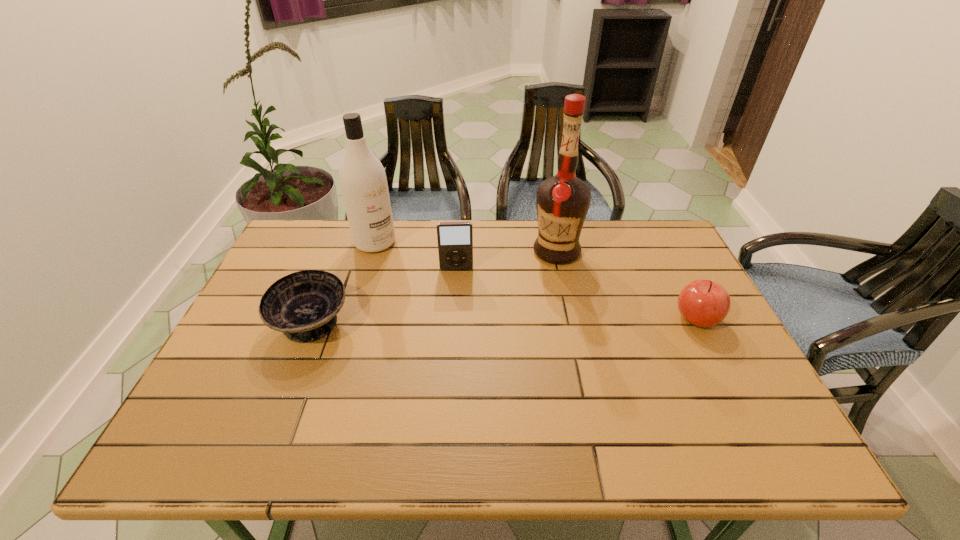
This screenshot has height=540, width=960. I want to click on free spot between the second tallest object and the fourth tallest object, so click(x=536, y=280).

Identify the location of empty location between the second shortest object and the iPod. This screenshot has height=540, width=960. (577, 294).

At what (x,y) coordinates should I click in order to perform the action: click on free point between the shortest object and the iPod. Please return your answer as a coordinate pair (x, y). Looking at the image, I should click on (384, 296).

You are a GUI agent. You are given a task and a screenshot of the screen. Output one action in this format:
    pyautogui.click(x=<x>, y=<y>)
    Task: Click on the vacant area between the liquor and the third object from right to left
    Image resolution: width=960 pixels, height=540 pixels.
    Given the screenshot: What is the action you would take?
    pyautogui.click(x=506, y=260)

The width and height of the screenshot is (960, 540). Find the location of `unoccupied position between the shortest object and the rightmost object`. unoccupied position between the shortest object and the rightmost object is located at coordinates (504, 321).

At what (x,y) coordinates should I click in order to perform the action: click on object that ranks as the third closest to the fourth object from left to right. Please return your answer as a coordinate pair (x, y). Looking at the image, I should click on (363, 182).

Image resolution: width=960 pixels, height=540 pixels. I want to click on the second closest object to the second shortest object, so click(x=455, y=239).

At what (x,y) coordinates should I click in order to perform the action: click on vacant space that satisfies the following two spatial constraints: 1. on the front side of the third object from left to right; 2. on the right side of the rightmost object. Please return your answer as a coordinate pair (x, y). The height and width of the screenshot is (540, 960). Looking at the image, I should click on (453, 318).